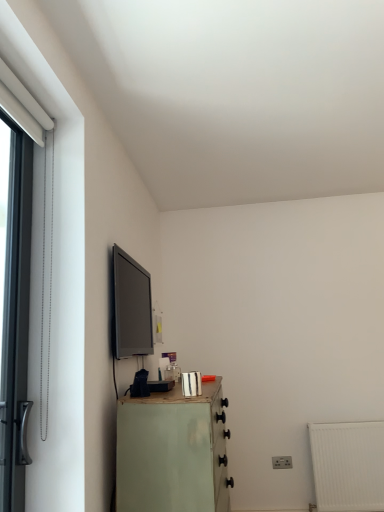
Question: Is metallic silver canister at lower center in front of or behind black metal door at left in the image?

Choices:
 (A) behind
 (B) front

Answer: (A)

Question: Considering the positions of point (183, 394) and point (11, 229), is point (183, 394) closer or farther from the camera than point (11, 229)?

Choices:
 (A) farther
 (B) closer

Answer: (A)

Question: Based on their relative distances, which object is nearer to the metallic silver canister at lower center?

Choices:
 (A) light green painted wood chest of drawers at lower left
 (B) black metal door at left
 (C) matte black tv at upper left

Answer: (A)

Question: Considering the real-world distances, which object is farthest from the light green painted wood chest of drawers at lower left?

Choices:
 (A) matte black tv at upper left
 (B) metallic silver canister at lower center
 (C) black metal door at left

Answer: (A)